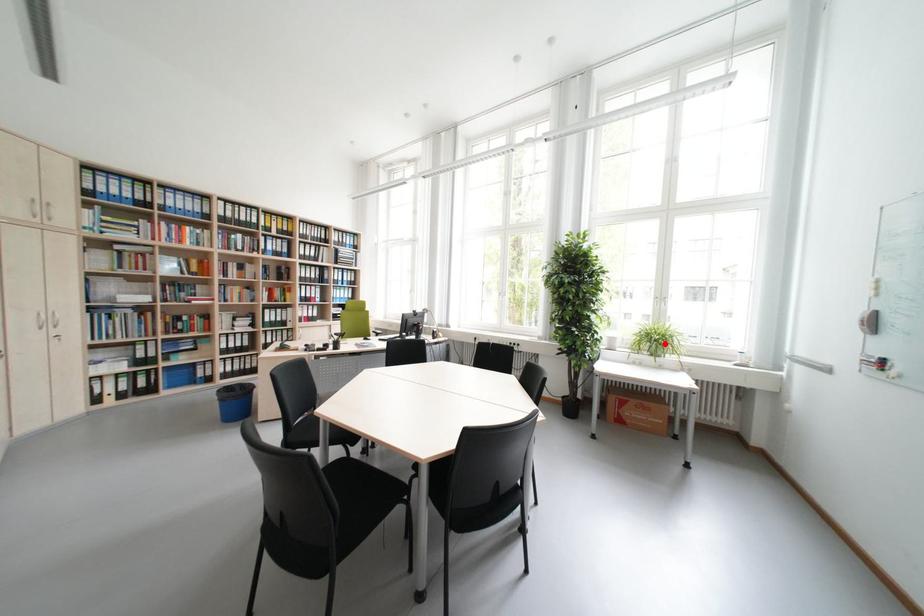
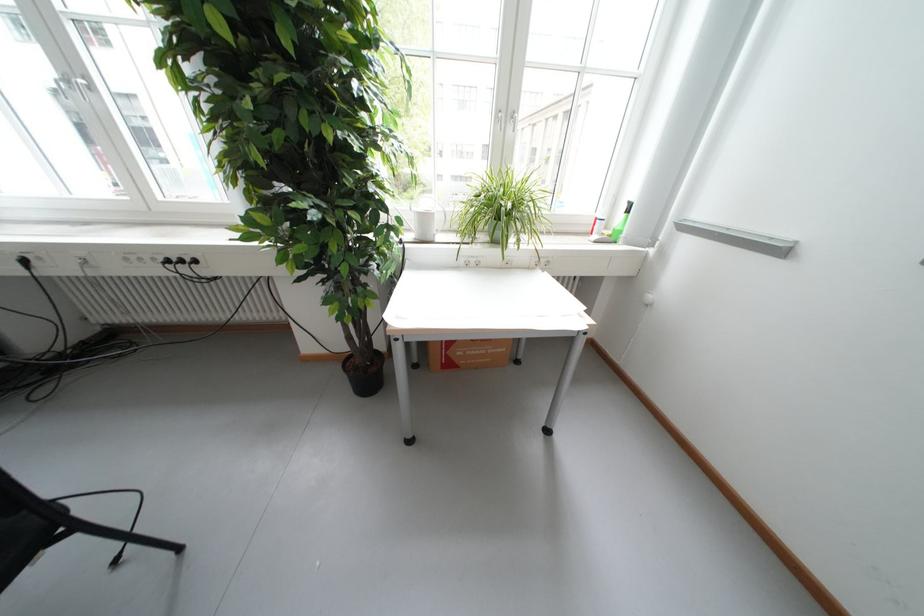
Question: I am providing you with two images of the same scene from different viewpoints. A red point is marked on the first image. At the location where the point appears in image 1, is it still visible in image 2?

Choices:
 (A) Yes
 (B) No

Answer: (A)